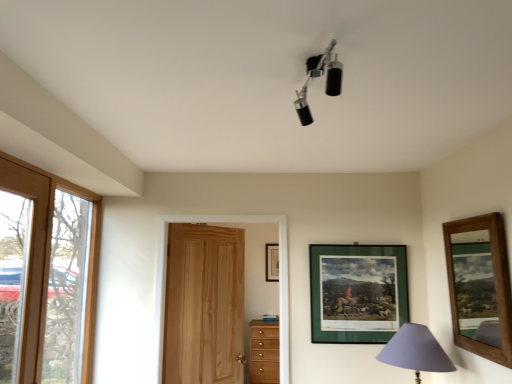
Question: Does purple fabric lampshade at lower right, acting as the 2th lamp starting from the front, appear on the right side of natural wood door at center?

Choices:
 (A) no
 (B) yes

Answer: (B)

Question: Is natural wood door at center at the back of purple fabric lampshade at lower right, the first lamp positioned from the bottom?

Choices:
 (A) no
 (B) yes

Answer: (A)

Question: Can you confirm if purple fabric lampshade at lower right, the first lamp positioned from the bottom, is thinner than natural wood door at center?

Choices:
 (A) no
 (B) yes

Answer: (A)

Question: Is purple fabric lampshade at lower right, acting as the first lamp starting from the right, oriented towards natural wood door at center?

Choices:
 (A) yes
 (B) no

Answer: (B)

Question: Is purple fabric lampshade at lower right, which is the first lamp from back to front, in front of natural wood door at center?

Choices:
 (A) yes
 (B) no

Answer: (A)

Question: Looking at their shapes, would you say wooden picture frame at upper center, placed as the 3th picture frame when sorted from front to back, is wider or thinner than green matte picture frame at upper center, the second picture frame in the back-to-front sequence?

Choices:
 (A) thin
 (B) wide

Answer: (A)

Question: In terms of height, does wooden picture frame at upper center, placed as the 3th picture frame when sorted from front to back, look taller or shorter compared to green matte picture frame at upper center, the second picture frame in the back-to-front sequence?

Choices:
 (A) short
 (B) tall

Answer: (A)

Question: Choose the correct answer: Is wooden picture frame at upper center, placed as the first picture frame when sorted from back to front, inside green matte picture frame at upper center, which is the 2th picture frame in right-to-left order, or outside it?

Choices:
 (A) inside
 (B) outside

Answer: (B)

Question: Is point (273, 248) positioned closer to the camera than point (310, 268)?

Choices:
 (A) closer
 (B) farther

Answer: (B)

Question: From the image's perspective, is green matte picture frame at upper center, which is the 2th picture frame in right-to-left order, located above or below natural wood door at center?

Choices:
 (A) above
 (B) below

Answer: (A)

Question: Looking at the image, does green matte picture frame at upper center, which is the 2th picture frame in right-to-left order, seem bigger or smaller compared to natural wood door at center?

Choices:
 (A) small
 (B) big

Answer: (A)

Question: Is green matte picture frame at upper center, the second picture frame positioned from the left, taller or shorter than natural wood door at center?

Choices:
 (A) short
 (B) tall

Answer: (A)

Question: Is green matte picture frame at upper center, placed as the second picture frame when sorted from front to back, wider or thinner than natural wood door at center?

Choices:
 (A) wide
 (B) thin

Answer: (B)

Question: From the image's perspective, relative to clear glass window at left, is wooden framed mirror at right, which appears as the third picture frame when viewed from the left, above or below?

Choices:
 (A) above
 (B) below

Answer: (A)

Question: Would you say wooden framed mirror at right, which ranks as the 3th picture frame in back-to-front order, is to the left or to the right of clear glass window at left in the picture?

Choices:
 (A) right
 (B) left

Answer: (A)